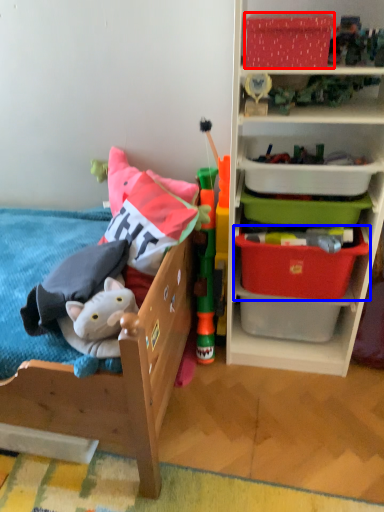
Question: Among these objects, which one is farthest to the camera, storage box (highlighted by a red box) or storage box (highlighted by a blue box)?

Choices:
 (A) storage box
 (B) storage box

Answer: (B)